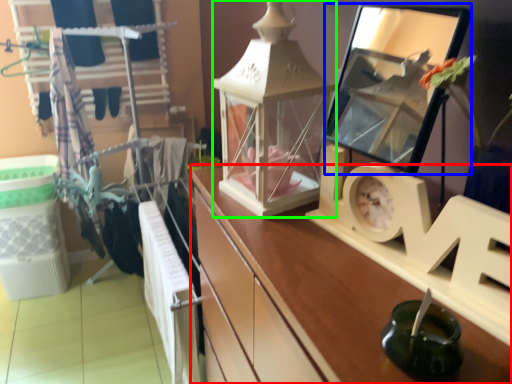
Question: Considering the real-world distances, which object is closest to cabinetry (highlighted by a red box)? mirror (highlighted by a blue box) or writing (highlighted by a green box).

Choices:
 (A) mirror
 (B) writing

Answer: (B)